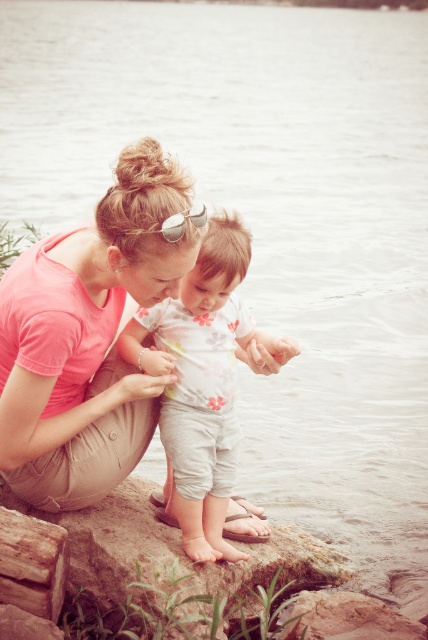
Question: Which point is closer to the camera?

Choices:
 (A) smooth gray rock at center
 (B) pink matte shirt at center
 (C) sunglasses at center
 (D) floral-patterned onesie at center

Answer: (C)

Question: Can you confirm if smooth gray rock at center is positioned to the right of sunglasses at center?

Choices:
 (A) yes
 (B) no

Answer: (A)

Question: Among these points, which one is farthest from the camera?

Choices:
 (A) (272, 540)
 (B) (169, 234)
 (C) (198, 285)
 (D) (44, 456)

Answer: (A)

Question: Does smooth gray rock at center appear over sunglasses at center?

Choices:
 (A) yes
 (B) no

Answer: (B)

Question: Which object is the closest to the floral-patterned onesie at center?

Choices:
 (A) smooth gray rock at center
 (B) pink matte shirt at center

Answer: (B)

Question: Can you confirm if pink matte shirt at center is positioned above floral-patterned onesie at center?

Choices:
 (A) yes
 (B) no

Answer: (A)